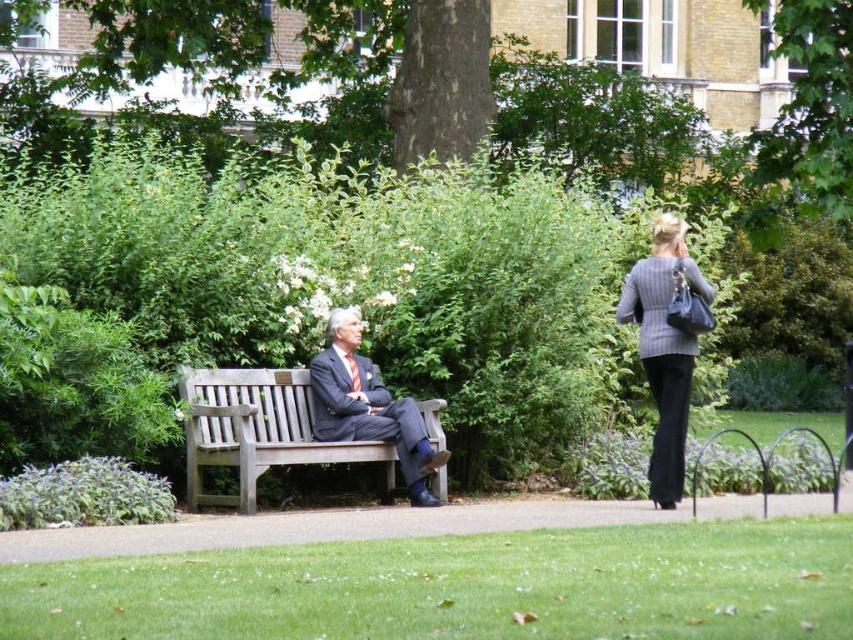
Which is more to the left, knitted gray sweater at right or dark gray suit at center?

dark gray suit at center is more to the left.

How far apart are knitted gray sweater at right and dark gray suit at center?

The distance of knitted gray sweater at right from dark gray suit at center is 13.28 feet.

Identify the location of knitted gray sweater at right. (666, 342).

I want to click on knitted gray sweater at right, so pyautogui.click(x=666, y=342).

Which is below, wooden bench at center or green leafy tree at upper right?

wooden bench at center

Does point (314, 442) come in front of point (837, 188)?

That is True.

I want to click on wooden bench at center, so click(259, 429).

Looking at this image, is green leafy tree at center positioned before dark gray suit at center?

No, it is not.

Between point (468, 122) and point (366, 365), which one is positioned behind?

The point (468, 122) is behind.

Where is `green leafy tree at center`? The image size is (853, 640). green leafy tree at center is located at coordinates (402, 64).